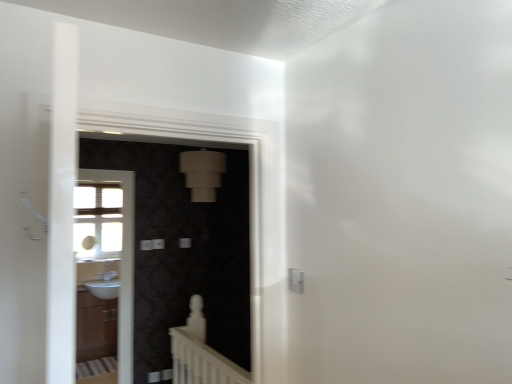
Question: Is matte black screen door at center, placed as the first screen door when sorted from right to left, at the right side of white matte balustrade at lower center?

Choices:
 (A) yes
 (B) no

Answer: (A)

Question: From the image's perspective, is matte black screen door at center, the 1th screen door viewed from the front, beneath white matte balustrade at lower center?

Choices:
 (A) yes
 (B) no

Answer: (B)

Question: Does matte black screen door at center, the 2th screen door from the left, have a greater height compared to white matte balustrade at lower center?

Choices:
 (A) no
 (B) yes

Answer: (B)

Question: Is matte black screen door at center, the 2th screen door positioned from the back, thinner than white matte balustrade at lower center?

Choices:
 (A) no
 (B) yes

Answer: (A)

Question: From a real-world perspective, is matte black screen door at center, the 1th screen door viewed from the front, located higher than white matte balustrade at lower center?

Choices:
 (A) no
 (B) yes

Answer: (B)

Question: From the image's perspective, is white glossy sink at lower left located above or below matte black screen door at center, the 1th screen door viewed from the front?

Choices:
 (A) above
 (B) below

Answer: (B)

Question: Is white glossy sink at lower left to the left or to the right of matte black screen door at center, the 2th screen door from the left, in the image?

Choices:
 (A) right
 (B) left

Answer: (B)

Question: Would you say white glossy sink at lower left is inside or outside matte black screen door at center, the 2th screen door positioned from the back?

Choices:
 (A) outside
 (B) inside

Answer: (A)

Question: From a real-world perspective, is white glossy sink at lower left positioned above or below matte black screen door at center, the 2th screen door from the left?

Choices:
 (A) above
 (B) below

Answer: (B)

Question: Is matte black screen door at center, the 2th screen door from the left, in front of or behind matte brown cabinet at lower left in the image?

Choices:
 (A) front
 (B) behind

Answer: (A)

Question: From a real-world perspective, is matte black screen door at center, the 1th screen door viewed from the front, positioned above or below matte brown cabinet at lower left?

Choices:
 (A) below
 (B) above

Answer: (B)

Question: Which is correct: matte black screen door at center, the 2th screen door positioned from the back, is inside matte brown cabinet at lower left, or outside of it?

Choices:
 (A) outside
 (B) inside

Answer: (A)

Question: In terms of size, does matte black screen door at center, the 1th screen door viewed from the front, appear bigger or smaller than matte brown cabinet at lower left?

Choices:
 (A) big
 (B) small

Answer: (B)

Question: From the image's perspective, is white glossy sink at left, acting as the 1th screen door starting from the back, above or below matte brown cabinet at lower left?

Choices:
 (A) above
 (B) below

Answer: (A)

Question: Would you say white glossy sink at left, arranged as the 2th screen door when viewed from the front, is inside or outside matte brown cabinet at lower left?

Choices:
 (A) outside
 (B) inside

Answer: (A)